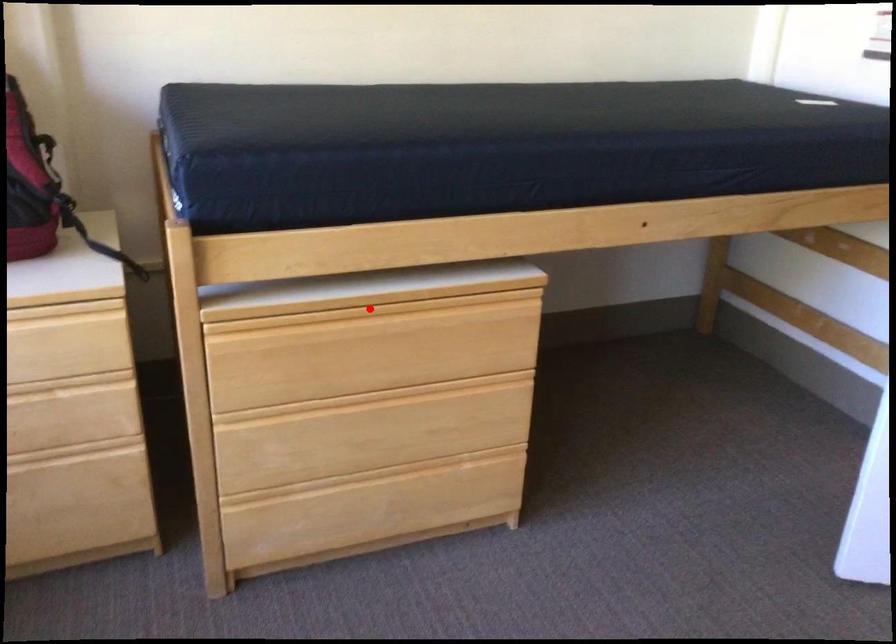
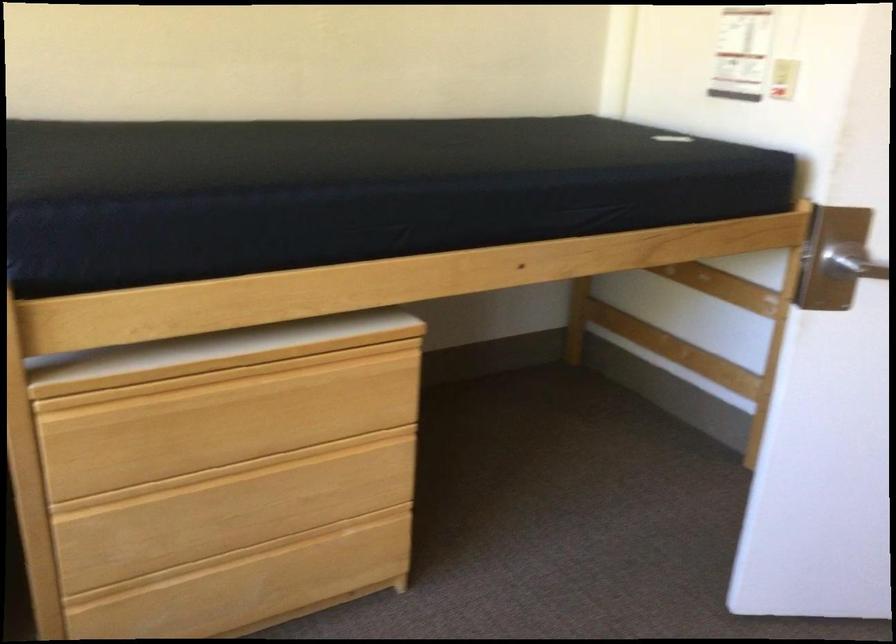
In the second image, find the point that corresponds to the highlighted location in the first image.

(227, 375)